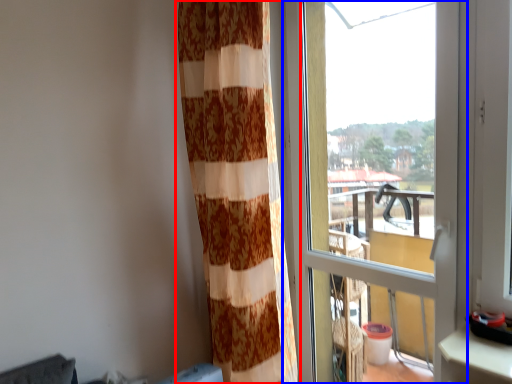
Question: Which object appears farthest to the camera in this image, curtain (highlighted by a red box) or window (highlighted by a blue box)?

Choices:
 (A) curtain
 (B) window

Answer: (A)